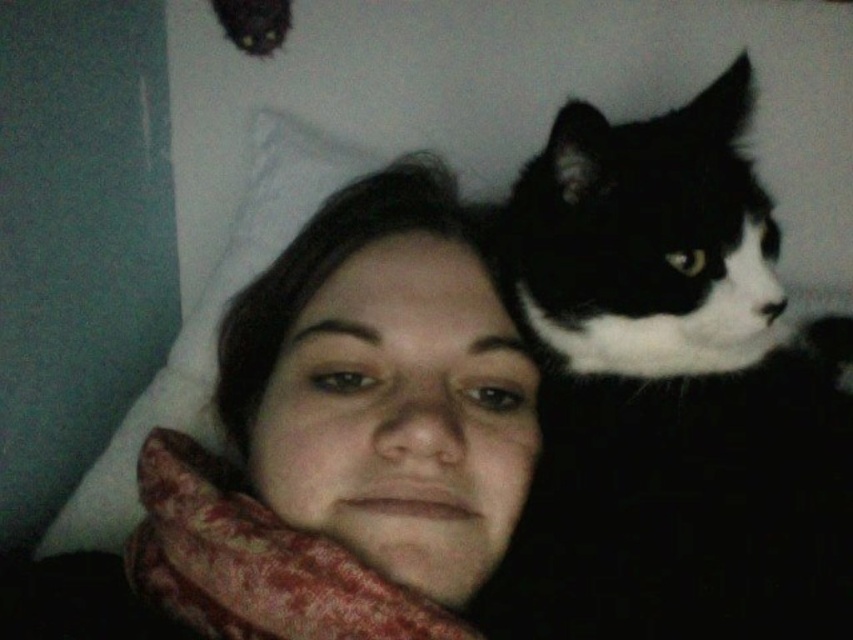
From the picture: Can you confirm if black and white fur at upper right is shorter than white soft pillow at upper left?

Yes, black and white fur at upper right is shorter than white soft pillow at upper left.

Does point (491, 216) come behind point (129, 442)?

No, (491, 216) is in front of (129, 442).

Locate an element on the screen. The image size is (853, 640). black and white fur at upper right is located at coordinates [670, 394].

The width and height of the screenshot is (853, 640). What are the coordinates of `black and white fur at upper right` in the screenshot? It's located at (670, 394).